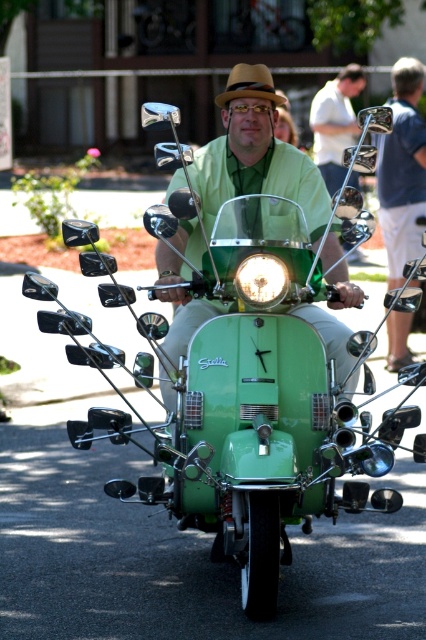
You are standing at the origin of a coordinate system where the image is mapped such that the bottom left corner is the origin. A green matte scooter at center is located at point (256, 166). If you want to move directly towards the green matte scooter at center, which direction should you move in?

To move directly towards the green matte scooter at center located at point (256, 166) from the origin, you should move northeast since the x and y coordinates are both positive.

You are standing at the origin point of a coordinate system placed over the image. The green matte scooter at center is at point (x=256, y=166). If you want to move towards the green matte scooter at center, in which direction should you move?

To move towards the green matte scooter at center located at point (x=256, y=166) from the origin, you should move in the direction of increasing x and y coordinates since the scooter is in the positive quadrant relative to the origin.